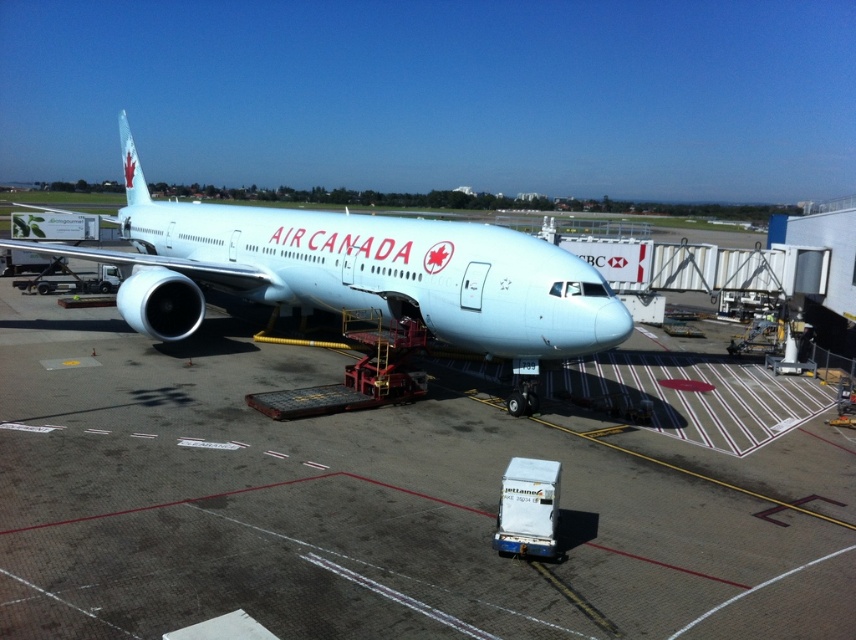
Question: Which point appears farthest from the camera in this image?

Choices:
 (A) (724, 476)
 (B) (568, 333)

Answer: (B)

Question: Considering the relative positions of white glossy tarmac at center and light blue metallic airplane at center in the image provided, where is white glossy tarmac at center located with respect to light blue metallic airplane at center?

Choices:
 (A) left
 (B) right

Answer: (B)

Question: Which object is closer to the camera taking this photo?

Choices:
 (A) white glossy tarmac at center
 (B) light blue metallic airplane at center

Answer: (A)

Question: Does white glossy tarmac at center come in front of light blue metallic airplane at center?

Choices:
 (A) yes
 (B) no

Answer: (A)

Question: Is the position of white glossy tarmac at center less distant than that of light blue metallic airplane at center?

Choices:
 (A) yes
 (B) no

Answer: (A)